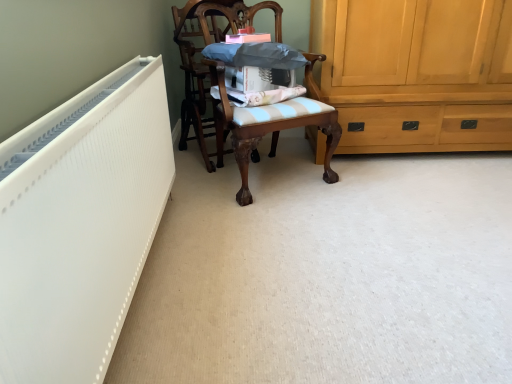
Question: From a real-world perspective, is wooden chair at center, which appears as the 2th chair when viewed from the right, located higher than light brown wood cabinet at right?

Choices:
 (A) yes
 (B) no

Answer: (A)

Question: Is wooden chair at center, which appears as the 2th chair when viewed from the right, positioned in front of light brown wood cabinet at right?

Choices:
 (A) no
 (B) yes

Answer: (B)

Question: Is wooden chair at center, which appears as the 2th chair when viewed from the right, completely or partially outside of light brown wood cabinet at right?

Choices:
 (A) yes
 (B) no

Answer: (A)

Question: Does wooden chair at center, which appears as the 2th chair when viewed from the right, have a lesser height compared to light brown wood cabinet at right?

Choices:
 (A) yes
 (B) no

Answer: (B)

Question: From the image's perspective, would you say wooden chair at center, which appears as the 2th chair when viewed from the right, is shown under light brown wood cabinet at right?

Choices:
 (A) no
 (B) yes

Answer: (B)

Question: Is white textured radiator at left taller or shorter than wooden chair at center, marked as the 1th chair in a left-to-right arrangement?

Choices:
 (A) short
 (B) tall

Answer: (A)

Question: From the image's perspective, relative to wooden chair at center, marked as the 1th chair in a left-to-right arrangement, is white textured radiator at left above or below?

Choices:
 (A) below
 (B) above

Answer: (A)

Question: In the image, is white textured radiator at left positioned in front of or behind wooden chair at center, which appears as the 2th chair when viewed from the right?

Choices:
 (A) behind
 (B) front

Answer: (B)

Question: Looking at the image, does white textured radiator at left seem bigger or smaller compared to wooden chair at center, marked as the 1th chair in a left-to-right arrangement?

Choices:
 (A) small
 (B) big

Answer: (B)

Question: Looking at their shapes, would you say blue striped fabric at center is wider or thinner than wooden chair at center, the 2th chair when ordered from left to right?

Choices:
 (A) wide
 (B) thin

Answer: (B)

Question: From a real-world perspective, is blue striped fabric at center physically located above or below wooden chair at center, the 2th chair when ordered from left to right?

Choices:
 (A) below
 (B) above

Answer: (B)

Question: Is point (212, 92) positioned closer to the camera than point (231, 145)?

Choices:
 (A) closer
 (B) farther

Answer: (A)

Question: From the image's perspective, relative to wooden chair at center, which is the 1th chair in right-to-left order, is blue striped fabric at center above or below?

Choices:
 (A) above
 (B) below

Answer: (A)

Question: Does point (399, 9) appear closer or farther from the camera than point (264, 132)?

Choices:
 (A) closer
 (B) farther

Answer: (B)

Question: From the image's perspective, is light brown wood cabinet at right above or below wooden chair at center, the 2th chair when ordered from left to right?

Choices:
 (A) below
 (B) above

Answer: (B)